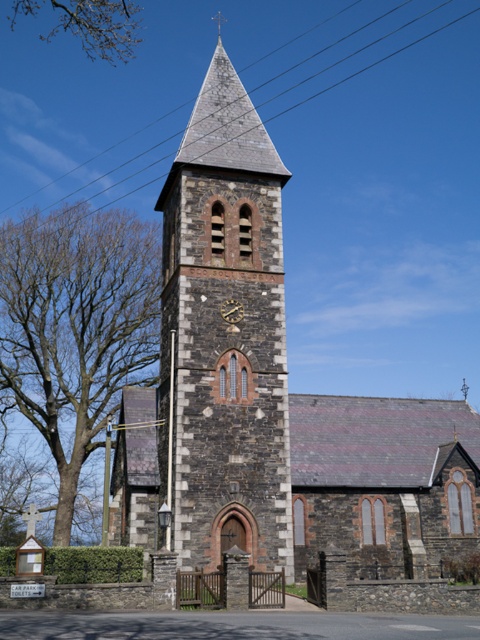
You are standing in front of the church and want to take a photo of both the dark gray stone clock tower at center and the brown leafless tree at left. Based on their positions, which object should you position to your left side in the camera frame?

You should position the brown leafless tree at left to your left side in the camera frame because the dark gray stone clock tower at center is to the right of the brown leafless tree at left.